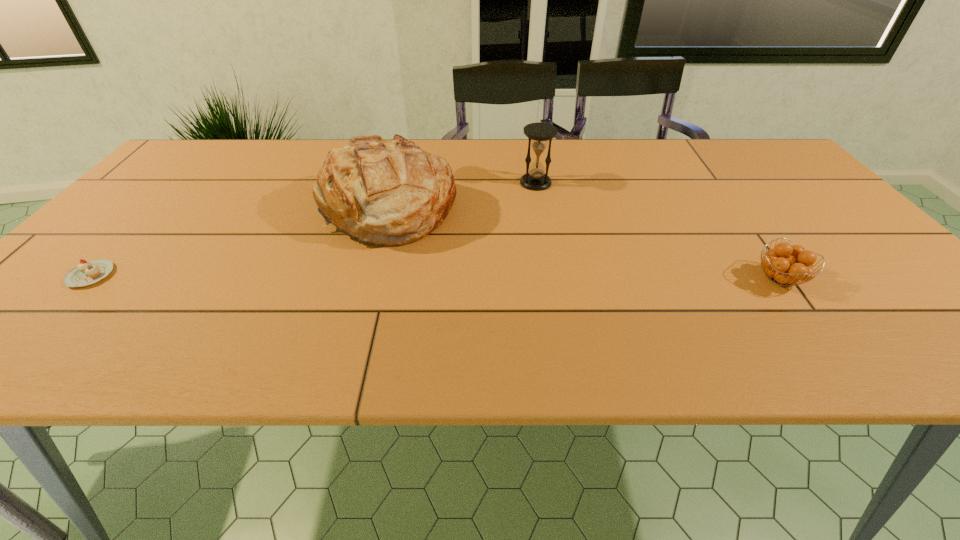
The image size is (960, 540). I want to click on free space located on the right of the third tallest object, so click(x=905, y=279).

I want to click on vacant space located 0.280m on the right of the leftmost object, so click(243, 275).

Where is `bread that is at the far edge`? bread that is at the far edge is located at coordinates (383, 192).

This screenshot has height=540, width=960. Identify the location of hourglass present at the far edge. pos(535,179).

The height and width of the screenshot is (540, 960). Find the location of `object at the left edge`. object at the left edge is located at coordinates (86, 273).

This screenshot has height=540, width=960. In order to click on free space at the far edge in this screenshot , I will do `click(257, 152)`.

Locate an element on the screen. vacant point at the near edge is located at coordinates (812, 351).

In the image, there is a desktop. Where is `vacant region at the left edge`? This screenshot has height=540, width=960. vacant region at the left edge is located at coordinates (111, 239).

In the image, there is a desktop. Where is `free region at the right edge`? free region at the right edge is located at coordinates (876, 295).

Locate an element on the screen. The height and width of the screenshot is (540, 960). free space at the near left corner is located at coordinates click(x=1, y=359).